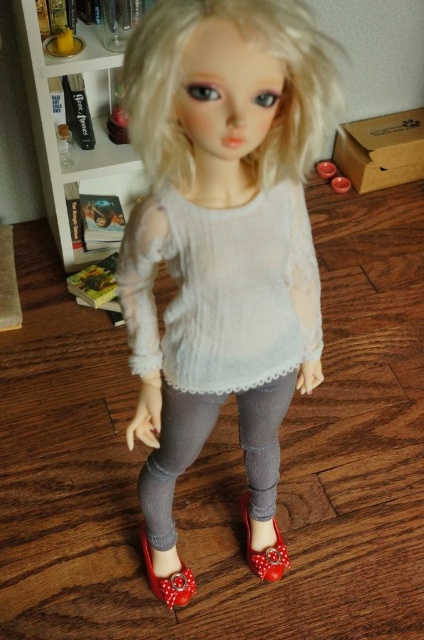
Question: Is matte gray leggings at center wider than blondehair at center?

Choices:
 (A) yes
 (B) no

Answer: (A)

Question: Which point appears farthest from the camera in this image?

Choices:
 (A) (275, 529)
 (B) (147, 163)
 (C) (189, 449)
 (D) (164, 592)

Answer: (A)

Question: Is matte gray leggings at center bigger than shiny red sandal at lower center?

Choices:
 (A) no
 (B) yes

Answer: (B)

Question: Does blondehair at center appear under shiny red fabric shoe at lower center?

Choices:
 (A) no
 (B) yes

Answer: (A)

Question: Which object is closer to the camera taking this photo?

Choices:
 (A) light gray knitted sweater at center
 (B) shiny red fabric shoe at lower center
 (C) matte gray leggings at center

Answer: (C)

Question: Estimate the real-world distances between objects in this image. Which object is closer to the blondehair at center?

Choices:
 (A) shiny red fabric shoe at lower center
 (B) shiny red sandal at lower center
 (C) light gray knitted sweater at center
 (D) matte gray leggings at center

Answer: (C)